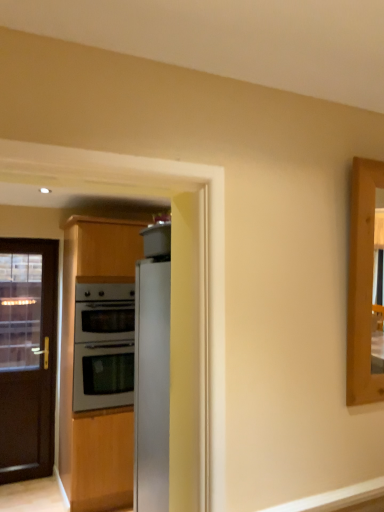
Question: Is satin silver oven at center oriented towards sleek metallic refrigerator at center?

Choices:
 (A) yes
 (B) no

Answer: (A)

Question: Can you confirm if satin silver oven at center is wider than sleek metallic refrigerator at center?

Choices:
 (A) no
 (B) yes

Answer: (B)

Question: Is satin silver oven at center not near sleek metallic refrigerator at center?

Choices:
 (A) yes
 (B) no

Answer: (A)

Question: Considering the relative sizes of satin silver oven at center and sleek metallic refrigerator at center in the image provided, is satin silver oven at center smaller than sleek metallic refrigerator at center?

Choices:
 (A) no
 (B) yes

Answer: (A)

Question: Is sleek metallic refrigerator at center inside satin silver oven at center?

Choices:
 (A) no
 (B) yes

Answer: (A)

Question: From a real-world perspective, is black glass door at left positioned above or below satin silver oven at center?

Choices:
 (A) below
 (B) above

Answer: (A)

Question: Would you say black glass door at left is to the left or to the right of satin silver oven at center in the picture?

Choices:
 (A) right
 (B) left

Answer: (B)

Question: In terms of height, does black glass door at left look taller or shorter compared to satin silver oven at center?

Choices:
 (A) tall
 (B) short

Answer: (A)

Question: From the image's perspective, is black glass door at left positioned above or below satin silver oven at center?

Choices:
 (A) below
 (B) above

Answer: (A)

Question: Which is correct: sleek metallic refrigerator at center is inside satin silver oven at center, or outside of it?

Choices:
 (A) inside
 (B) outside

Answer: (B)

Question: From the image's perspective, is sleek metallic refrigerator at center positioned above or below satin silver oven at center?

Choices:
 (A) below
 (B) above

Answer: (B)

Question: Looking at the image, does sleek metallic refrigerator at center seem bigger or smaller compared to satin silver oven at center?

Choices:
 (A) small
 (B) big

Answer: (A)

Question: From a real-world perspective, is sleek metallic refrigerator at center above or below satin silver oven at center?

Choices:
 (A) below
 (B) above

Answer: (A)

Question: Considering the positions of black glass door at left and sleek metallic refrigerator at center in the image, is black glass door at left bigger or smaller than sleek metallic refrigerator at center?

Choices:
 (A) big
 (B) small

Answer: (A)

Question: Based on their positions, is black glass door at left located to the left or right of sleek metallic refrigerator at center?

Choices:
 (A) left
 (B) right

Answer: (A)